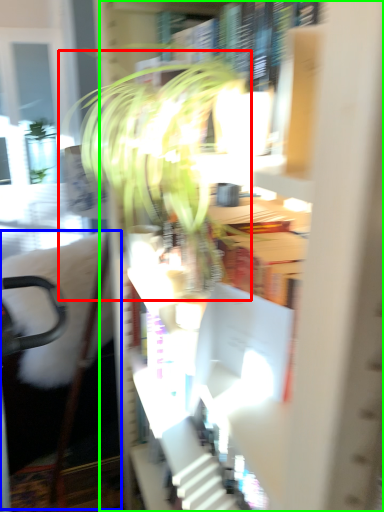
Question: Considering the real-world distances, which object is farthest from houseplant (highlighted by a red box)? swivel chair (highlighted by a blue box) or bookcase (highlighted by a green box)?

Choices:
 (A) swivel chair
 (B) bookcase

Answer: (A)